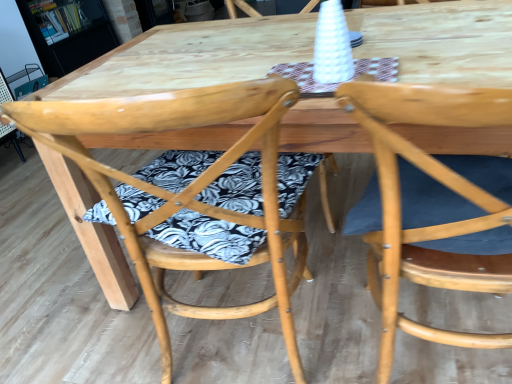
Question: Is natural wood chair at right, marked as the second chair in a left-to-right arrangement, directly adjacent to natural wood chair at center, the 2th chair viewed from the right?

Choices:
 (A) no
 (B) yes

Answer: (A)

Question: From the image's perspective, is natural wood chair at right, marked as the second chair in a left-to-right arrangement, above natural wood chair at center, placed as the first chair when sorted from left to right?

Choices:
 (A) no
 (B) yes

Answer: (A)

Question: Does natural wood chair at right, acting as the first chair starting from the right, have a lesser width compared to natural wood chair at center, the 2th chair viewed from the right?

Choices:
 (A) no
 (B) yes

Answer: (B)

Question: Does natural wood chair at right, acting as the first chair starting from the right, come in front of natural wood chair at center, placed as the first chair when sorted from left to right?

Choices:
 (A) no
 (B) yes

Answer: (B)

Question: Does natural wood chair at right, marked as the second chair in a left-to-right arrangement, have a greater height compared to natural wood chair at center, the 2th chair viewed from the right?

Choices:
 (A) no
 (B) yes

Answer: (A)

Question: In terms of size, does natural wood chair at right, marked as the second chair in a left-to-right arrangement, appear bigger or smaller than wooden bookshelf at upper left?

Choices:
 (A) small
 (B) big

Answer: (A)

Question: Visually, is natural wood chair at right, marked as the second chair in a left-to-right arrangement, positioned to the left or to the right of wooden bookshelf at upper left?

Choices:
 (A) right
 (B) left

Answer: (A)

Question: In terms of width, does natural wood chair at right, acting as the first chair starting from the right, look wider or thinner when compared to wooden bookshelf at upper left?

Choices:
 (A) wide
 (B) thin

Answer: (A)

Question: Considering the positions of natural wood chair at right, marked as the second chair in a left-to-right arrangement, and wooden bookshelf at upper left in the image, is natural wood chair at right, marked as the second chair in a left-to-right arrangement, taller or shorter than wooden bookshelf at upper left?

Choices:
 (A) short
 (B) tall

Answer: (B)

Question: Do you think wooden bookshelf at upper left is within natural wood chair at center, placed as the first chair when sorted from left to right, or outside of it?

Choices:
 (A) inside
 (B) outside

Answer: (B)

Question: Looking at their shapes, would you say wooden bookshelf at upper left is wider or thinner than natural wood chair at center, the 2th chair viewed from the right?

Choices:
 (A) wide
 (B) thin

Answer: (B)

Question: Visually, is wooden bookshelf at upper left positioned to the left or to the right of natural wood chair at center, the 2th chair viewed from the right?

Choices:
 (A) left
 (B) right

Answer: (A)

Question: In the image, is wooden bookshelf at upper left positioned in front of or behind natural wood chair at center, placed as the first chair when sorted from left to right?

Choices:
 (A) behind
 (B) front

Answer: (A)

Question: In the image, is natural wood chair at right, marked as the second chair in a left-to-right arrangement, positioned in front of or behind natural wood chair at center, placed as the first chair when sorted from left to right?

Choices:
 (A) behind
 (B) front

Answer: (B)

Question: From a real-world perspective, is natural wood chair at right, acting as the first chair starting from the right, positioned above or below natural wood chair at center, placed as the first chair when sorted from left to right?

Choices:
 (A) above
 (B) below

Answer: (B)